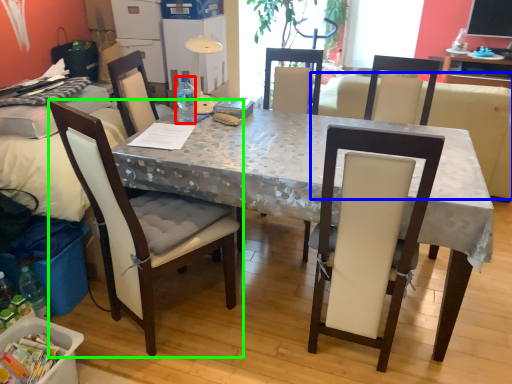
Question: Which is nearer to the bottle (highlighted by a red box)? couch (highlighted by a blue box) or chair (highlighted by a green box).

Choices:
 (A) couch
 (B) chair

Answer: (B)